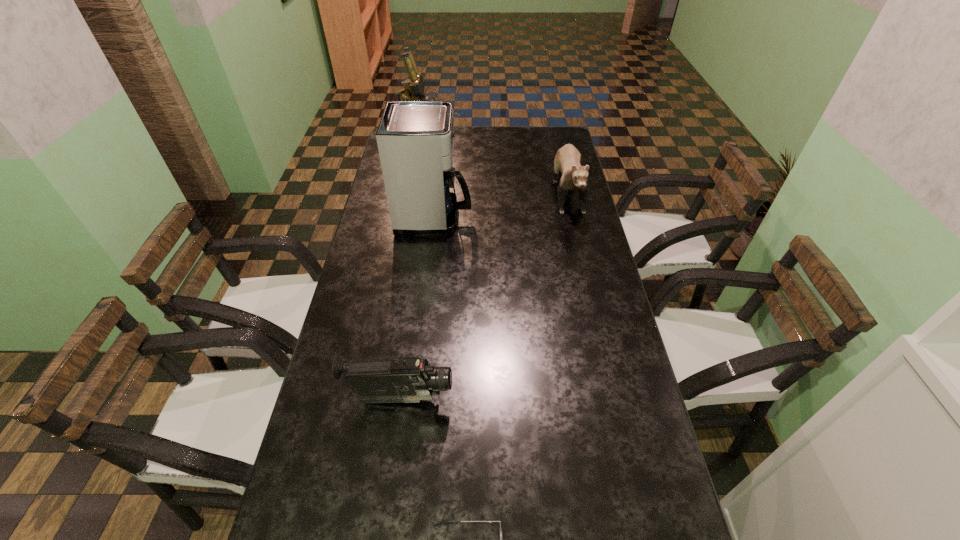
The width and height of the screenshot is (960, 540). Find the location of `object located at the right edge`. object located at the right edge is located at coordinates (416, 205).

Find the location of a particular element. This screenshot has width=960, height=540. object at the far left corner is located at coordinates (537, 256).

Locate an element on the screen. This screenshot has width=960, height=540. vacant space at the far edge is located at coordinates (511, 139).

Identify the location of vacant area at the left edge. (364, 433).

In the image, there is a desktop. At what (x,y) coordinates should I click in order to perform the action: click on free region at the right edge. Please return your answer as a coordinate pair (x, y). This screenshot has width=960, height=540. Looking at the image, I should click on (580, 406).

Locate an element on the screen. The height and width of the screenshot is (540, 960). free space at the far right corner is located at coordinates (541, 143).

I want to click on object identified as the closest to the shortest object, so click(379, 268).

This screenshot has height=540, width=960. What are the coordinates of `object that is the second nearest to the nearest object` in the screenshot? It's located at (416, 205).

Identify the location of vacant position in the image that satisfies the following two spatial constraints: 1. on the face of the third tallest object; 2. on the front panel of the coffee maker. The image size is (960, 540). (574, 217).